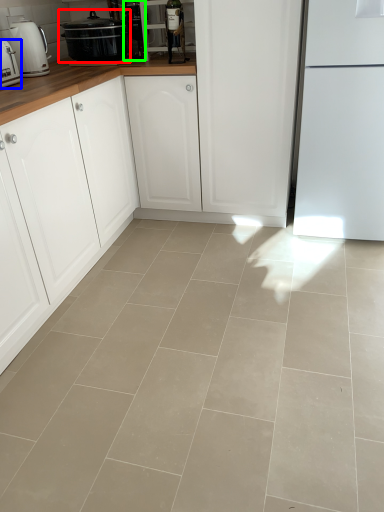
Question: Which object is the closest to the home appliance (highlighted by a red box)? Choose among these: kitchen appliance (highlighted by a blue box) or appliance (highlighted by a green box).

Choices:
 (A) kitchen appliance
 (B) appliance

Answer: (B)